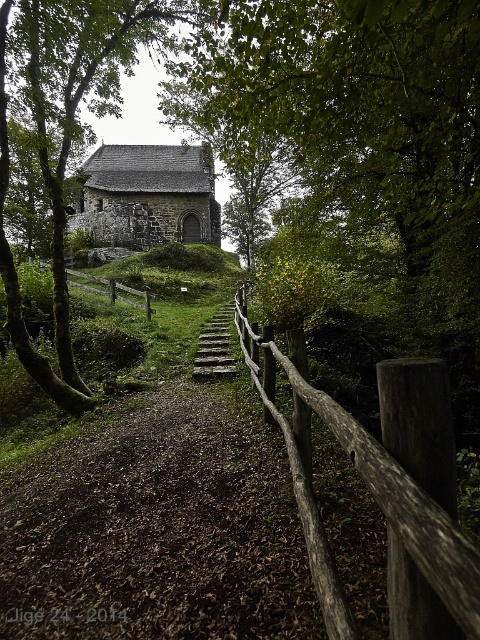
Can you confirm if stone church at center is positioned to the left of stone steps at center?

Indeed, stone church at center is positioned on the left side of stone steps at center.

Does stone church at center have a lesser width compared to stone steps at center?

No, stone church at center is not thinner than stone steps at center.

Between point (123, 180) and point (216, 353), which one is positioned behind?

The point (123, 180) is behind.

The width and height of the screenshot is (480, 640). Identify the location of stone church at center. (148, 196).

Does rustic wooden fence at center have a lesser height compared to stone steps at center?

No.

Does rustic wooden fence at center have a greater width compared to stone steps at center?

No, rustic wooden fence at center is not wider than stone steps at center.

Image resolution: width=480 pixels, height=640 pixels. I want to click on rustic wooden fence at center, so click(x=374, y=486).

Where is `rustic wooden fence at center`? rustic wooden fence at center is located at coordinates (374, 486).

Measure the distance between point (x=302, y=358) and camera.

3.63 meters

From the picture: Is rustic wooden fence at center taller than stone church at center?

No, rustic wooden fence at center is not taller than stone church at center.

Does point (308, 432) come in front of point (156, 148)?

Yes.

Find the location of a particular element. rustic wooden fence at center is located at coordinates (374, 486).